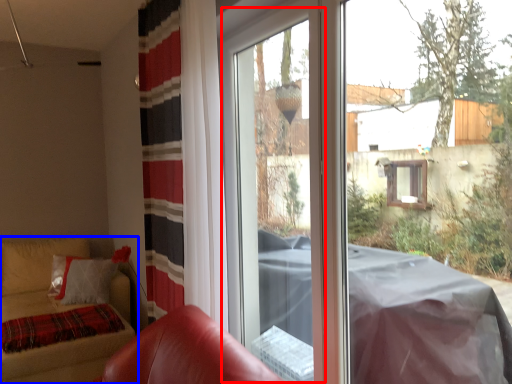
Question: Which object appears farthest to the camera in this image, screen door (highlighted by a red box) or furniture (highlighted by a blue box)?

Choices:
 (A) screen door
 (B) furniture

Answer: (B)